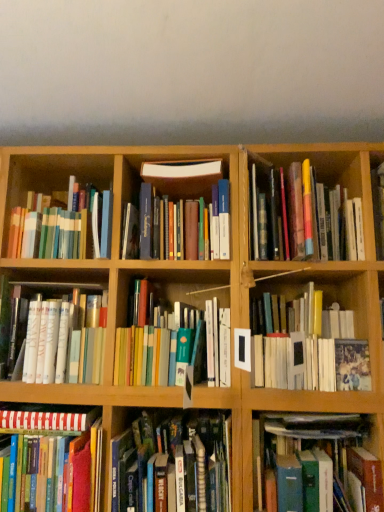
What do you see at coordinates (63, 336) in the screenshot? I see `white matte book at left, the second book viewed from the left` at bounding box center [63, 336].

Identify the location of white matte book at left, the second book viewed from the left. The width and height of the screenshot is (384, 512). (63, 336).

The width and height of the screenshot is (384, 512). What do you see at coordinates (175, 348) in the screenshot?
I see `hardcover books at center, positioned as the fifth book in right-to-left order` at bounding box center [175, 348].

You are a GUI agent. You are given a task and a screenshot of the screen. Output one action in this format:
    pyautogui.click(x=<x>, y=<y>)
    Task: Click on the hardcover books at center, the 5th book when ordered from left to right
    The width and height of the screenshot is (384, 512).
    Given the screenshot: What is the action you would take?
    (x=175, y=348)

Where is `hardcover books at center, which is counted as the 6th book, starting from the right`? Image resolution: width=384 pixels, height=512 pixels. hardcover books at center, which is counted as the 6th book, starting from the right is located at coordinates (173, 463).

Find the location of a particular element. The image size is (384, 512). white matte book at left, placed as the 8th book when sorted from right to left is located at coordinates (63, 336).

Which of these two, striped paper book at lower left, arranged as the 1th book when viewed from the left, or white matte book at left, placed as the 8th book when sorted from right to left, stands taller?

striped paper book at lower left, arranged as the 1th book when viewed from the left, is taller.

You are a GUI agent. You are given a task and a screenshot of the screen. Output one action in this format:
    pyautogui.click(x=<x>, y=<y>)
    Task: Click on the 2nd book above the striped paper book at lower left, arranged as the 1th book when viewed from the left (from the image's perspective)
    The width and height of the screenshot is (384, 512).
    Given the screenshot: What is the action you would take?
    pyautogui.click(x=63, y=336)

Considering the sizes of objects striped paper book at lower left, arranged as the 1th book when viewed from the left, and white matte book at left, placed as the 8th book when sorted from right to left, in the image provided, who is thinner, striped paper book at lower left, arranged as the 1th book when viewed from the left, or white matte book at left, placed as the 8th book when sorted from right to left,?

With smaller width is white matte book at left, placed as the 8th book when sorted from right to left.

Is white matte book at left, the second book viewed from the left, completely or partially inside striped paper book at lower left, arranged as the 1th book when viewed from the left?

No, striped paper book at lower left, arranged as the 1th book when viewed from the left, does not contain white matte book at left, the second book viewed from the left.

From a real-world perspective, is hardcover book at lower right, positioned as the 3th book in right-to-left order, over hardcover books at upper right, marked as the first book in a right-to-left arrangement?

No, from a real-world perspective, hardcover book at lower right, positioned as the 3th book in right-to-left order, is not over hardcover books at upper right, marked as the first book in a right-to-left arrangement

Is hardcover book at lower right, positioned as the 7th book in left-to-right order, positioned with its back to hardcover books at upper right, placed as the 9th book when sorted from left to right?

hardcover book at lower right, positioned as the 7th book in left-to-right order, is not turned away from hardcover books at upper right, placed as the 9th book when sorted from left to right.

Considering the relative positions of hardcover book at lower right, positioned as the 3th book in right-to-left order, and hardcover books at upper right, placed as the 9th book when sorted from left to right, in the image provided, is hardcover book at lower right, positioned as the 3th book in right-to-left order, to the left or to the right of hardcover books at upper right, placed as the 9th book when sorted from left to right,?

hardcover book at lower right, positioned as the 3th book in right-to-left order, is positioned on hardcover books at upper right, placed as the 9th book when sorted from left to right,'s left side.

How far apart are hardcover book at lower right, positioned as the 7th book in left-to-right order, and hardcover books at upper right, marked as the first book in a right-to-left arrangement?

The distance of hardcover book at lower right, positioned as the 7th book in left-to-right order, from hardcover books at upper right, marked as the first book in a right-to-left arrangement, is 23.56 inches.

Between white matte book at left, the second book viewed from the left, and hardcover books at upper right, marked as the first book in a right-to-left arrangement, which one appears on the left side from the viewer's perspective?

From the viewer's perspective, white matte book at left, the second book viewed from the left, appears more on the left side.

Is white matte book at left, the second book viewed from the left, with hardcover books at upper right, placed as the 9th book when sorted from left to right?

No, white matte book at left, the second book viewed from the left, is not in contact with hardcover books at upper right, placed as the 9th book when sorted from left to right.

Consider the image. Considering the sizes of white matte book at left, the second book viewed from the left, and hardcover books at upper right, marked as the first book in a right-to-left arrangement, in the image, is white matte book at left, the second book viewed from the left, wider or thinner than hardcover books at upper right, marked as the first book in a right-to-left arrangement,?

Considering their sizes, white matte book at left, the second book viewed from the left, looks slimmer than hardcover books at upper right, marked as the first book in a right-to-left arrangement.

From the image's perspective, does white matte book at left, placed as the 8th book when sorted from right to left, appear higher than hardcover books at upper right, placed as the 9th book when sorted from left to right?

No, from the image's perspective, white matte book at left, placed as the 8th book when sorted from right to left, is not over hardcover books at upper right, placed as the 9th book when sorted from left to right.

Is hardcover book at lower right, positioned as the 3th book in right-to-left order, not close to hardcover book at center, which is the 6th book from left to right?

No, hardcover book at lower right, positioned as the 3th book in right-to-left order, is not far from hardcover book at center, which is the 6th book from left to right.

At what (x,y) coordinates should I click in order to perform the action: click on the 6th book positioned below the hardcover book at center, which is the 6th book from left to right (from the image's perspective). Please return your answer as a coordinate pair (x, y). This screenshot has height=512, width=384. Looking at the image, I should click on (320, 464).

Between white matte book at left, the second book viewed from the left, and multicolored hardcover books at upper left, the third book in the left-to-right sequence, which one has larger size?

With larger size is multicolored hardcover books at upper left, the third book in the left-to-right sequence.

Can you tell me how much white matte book at left, placed as the 8th book when sorted from right to left, and multicolored hardcover books at upper left, the third book in the left-to-right sequence, differ in facing direction?

The angular difference between white matte book at left, placed as the 8th book when sorted from right to left, and multicolored hardcover books at upper left, the third book in the left-to-right sequence, is 0.000338 degrees.

From the image's perspective, which one is positioned higher, white matte book at left, placed as the 8th book when sorted from right to left, or multicolored hardcover books at upper left, the 7th book in the right-to-left sequence?

multicolored hardcover books at upper left, the 7th book in the right-to-left sequence, from the image's perspective.

In the scene shown: Considering the relative sizes of white matte book at left, the second book viewed from the left, and multicolored hardcover books at upper left, the third book in the left-to-right sequence, in the image provided, is white matte book at left, the second book viewed from the left, thinner than multicolored hardcover books at upper left, the third book in the left-to-right sequence,?

Yes.

Starting from the striped paper book at lower left, marked as the 9th book in a right-to-left arrangement, which book is the 1st one behind? Please provide its 2D coordinates.

[(320, 464)]

Which of these two, striped paper book at lower left, marked as the 9th book in a right-to-left arrangement, or hardcover book at lower right, positioned as the 3th book in right-to-left order, is thinner?

With smaller width is hardcover book at lower right, positioned as the 3th book in right-to-left order.

Is point (86, 433) closer to viewer compared to point (320, 495)?

No, it is not.

Does striped paper book at lower left, arranged as the 1th book when viewed from the left, have a greater height compared to hardcover book at lower right, positioned as the 3th book in right-to-left order?

No, striped paper book at lower left, arranged as the 1th book when viewed from the left, is not taller than hardcover book at lower right, positioned as the 3th book in right-to-left order.

Could you measure the distance between multicolored hardcover books at upper left, the 7th book in the right-to-left sequence, and white matte book at left, the second book viewed from the left?

multicolored hardcover books at upper left, the 7th book in the right-to-left sequence, is 9.64 inches away from white matte book at left, the second book viewed from the left.

In the image, is multicolored hardcover books at upper left, the third book in the left-to-right sequence, positioned in front of or behind white matte book at left, the second book viewed from the left?

Visually, multicolored hardcover books at upper left, the third book in the left-to-right sequence, is located behind white matte book at left, the second book viewed from the left.

Is multicolored hardcover books at upper left, the 7th book in the right-to-left sequence, facing away from white matte book at left, the second book viewed from the left?

No, multicolored hardcover books at upper left, the 7th book in the right-to-left sequence, is not facing the opposite direction of white matte book at left, the second book viewed from the left.

You are a GUI agent. You are given a task and a screenshot of the screen. Output one action in this format:
    pyautogui.click(x=<x>, y=<y>)
    Task: Click on the book that is the 7th object located behind the striped paper book at lower left, arranged as the 1th book when viewed from the left
    Image resolution: width=384 pixels, height=512 pixels.
    Given the screenshot: What is the action you would take?
    pyautogui.click(x=63, y=336)

At what (x,y) coordinates should I click in order to perform the action: click on book that is the 8th one when counting downward from the hardcover books at upper right, marked as the first book in a right-to-left arrangement (from the image's perspective). Please return your answer as a coordinate pair (x, y). This screenshot has height=512, width=384. Looking at the image, I should click on (320, 464).

Which object lies further to the anchor point hardcover books at upper right, placed as the 9th book when sorted from left to right, white matte book at left, the second book viewed from the left, or hardcover books at center, positioned as the fifth book in right-to-left order?

The object further to hardcover books at upper right, placed as the 9th book when sorted from left to right, is white matte book at left, the second book viewed from the left.

Estimate the real-world distances between objects in this image. Which object is further from hardcover books at upper right, marked as the first book in a right-to-left arrangement, hardcover book at lower right, positioned as the 3th book in right-to-left order, or hardcover book at center right, which is the eighth book from left to right?

hardcover book at lower right, positioned as the 3th book in right-to-left order, is further to hardcover books at upper right, marked as the first book in a right-to-left arrangement.

From the picture: Considering their positions, is hardcover books at upper right, placed as the 9th book when sorted from left to right, positioned closer to hardcover books at center, the 5th book when ordered from left to right, than white matte book at left, the second book viewed from the left?

white matte book at left, the second book viewed from the left.

Looking at the image, which one is located closer to white matte book at left, the second book viewed from the left, multicolored hardcover books at upper left, the third book in the left-to-right sequence, or hardcover books at center, the 5th book when ordered from left to right?

hardcover books at center, the 5th book when ordered from left to right, is positioned closer to the anchor white matte book at left, the second book viewed from the left.

Based on their spatial positions, is hardcover book at lower right, positioned as the 7th book in left-to-right order, or hardcover books at center, which appears as the fourth book when viewed from the left, further from hardcover book at center right, which is the eighth book from left to right?

Among the two, hardcover books at center, which appears as the fourth book when viewed from the left, is located further to hardcover book at center right, which is the eighth book from left to right.

From the image, which object appears to be nearer to hardcover book at center, the fourth book viewed from the right, hardcover books at center, the 5th book when ordered from left to right, or multicolored hardcover books at upper left, the third book in the left-to-right sequence?

multicolored hardcover books at upper left, the third book in the left-to-right sequence.

Based on their spatial positions, is white matte book at left, the second book viewed from the left, or hardcover books at upper right, placed as the 9th book when sorted from left to right, closer to hardcover book at center, which is the 6th book from left to right?

hardcover books at upper right, placed as the 9th book when sorted from left to right, is positioned closer to the anchor hardcover book at center, which is the 6th book from left to right.

Considering their positions, is multicolored hardcover books at upper left, the third book in the left-to-right sequence, positioned further to hardcover book at center, which is the 6th book from left to right, than striped paper book at lower left, arranged as the 1th book when viewed from the left?

Based on the image, striped paper book at lower left, arranged as the 1th book when viewed from the left, appears to be further to hardcover book at center, which is the 6th book from left to right.

The image size is (384, 512). I want to click on book between white matte book at left, the second book viewed from the left, and striped paper book at lower left, arranged as the 1th book when viewed from the left, in the vertical direction, so click(x=173, y=463).

Locate an element on the screen. This screenshot has width=384, height=512. book between hardcover books at center, positioned as the fifth book in right-to-left order, and hardcover books at center, which appears as the fourth book when viewed from the left, in the up-down direction is located at coordinates (63, 336).